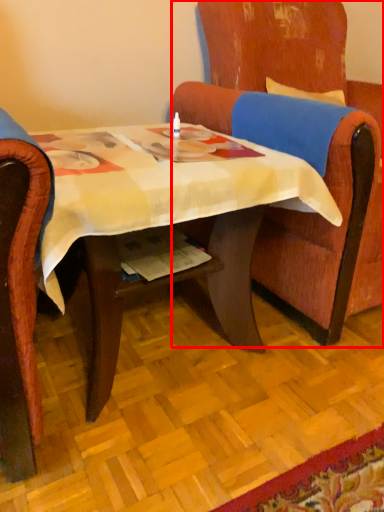
Question: From the image's perspective, where is chair (annotated by the red box) located relative to desk?

Choices:
 (A) above
 (B) below

Answer: (A)